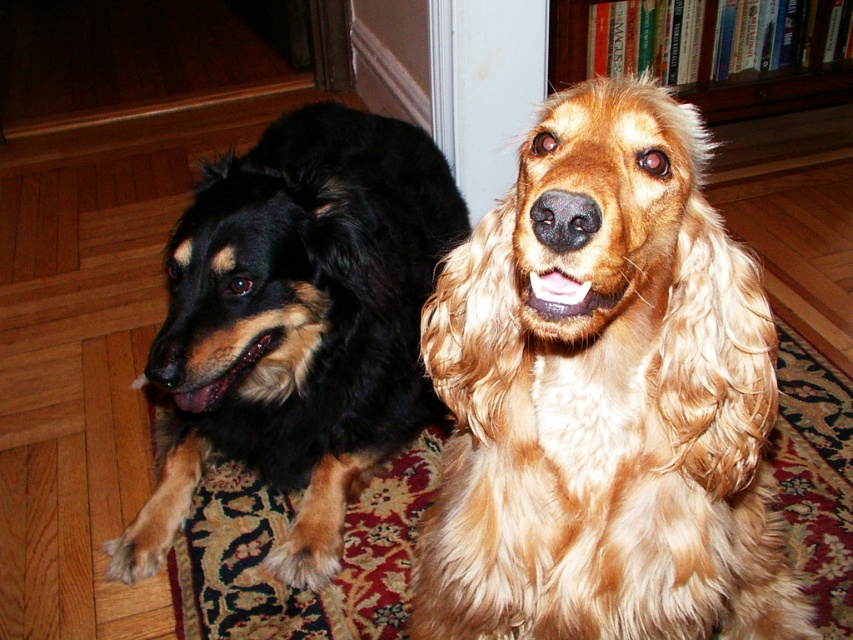
Question: Does golden fur dog at center appear under wooden bookshelf at upper center?

Choices:
 (A) yes
 (B) no

Answer: (A)

Question: Is golden fur dog at center wider than wooden bookshelf at upper center?

Choices:
 (A) yes
 (B) no

Answer: (B)

Question: Which object is positioned closest to the wooden bookshelf at upper center?

Choices:
 (A) golden fur dog at center
 (B) black fur dog at left

Answer: (B)

Question: Among these objects, which one is nearest to the camera?

Choices:
 (A) black fur dog at left
 (B) wooden bookshelf at upper center
 (C) golden fur dog at center

Answer: (C)

Question: Can you confirm if golden fur dog at center is bigger than black fur dog at left?

Choices:
 (A) yes
 (B) no

Answer: (B)

Question: Which of the following is the closest to the observer?

Choices:
 (A) golden fur dog at center
 (B) black fur dog at left

Answer: (A)